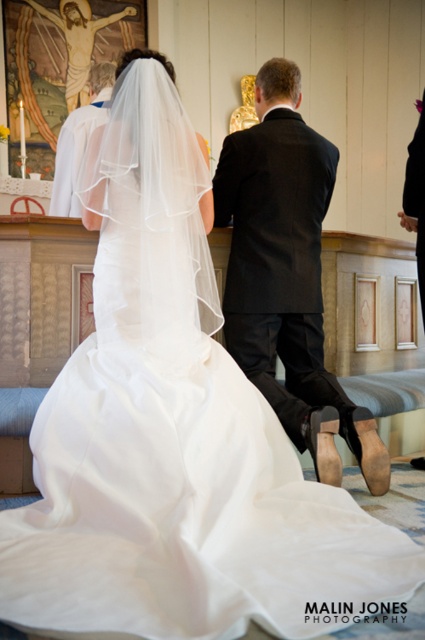
You are a photographer setting up for a wedding photo. You need to position a lighting stand between the black satin suit at center and the matte white robe at upper center. Which side of the two should the stand be placed closer to, considering their widths?

The black satin suit at center is wider than the matte white robe at upper center. Therefore, the lighting stand should be placed closer to the matte white robe at upper center to balance the composition.

You are a photographer setting up for a wedding photo. You need to position a spotlight so it shines on both the black satin suit at center and the matte white robe at upper center. Since the spotlight can only illuminate one area at a time, which object should you aim the spotlight at first to ensure both are lit?

The black satin suit at center is located below the matte white robe at upper center. To ensure both are lit, aim the spotlight at the matte white robe at upper center first, as it is higher up and the light can then naturally cascade downward to illuminate the black satin suit at center below it.